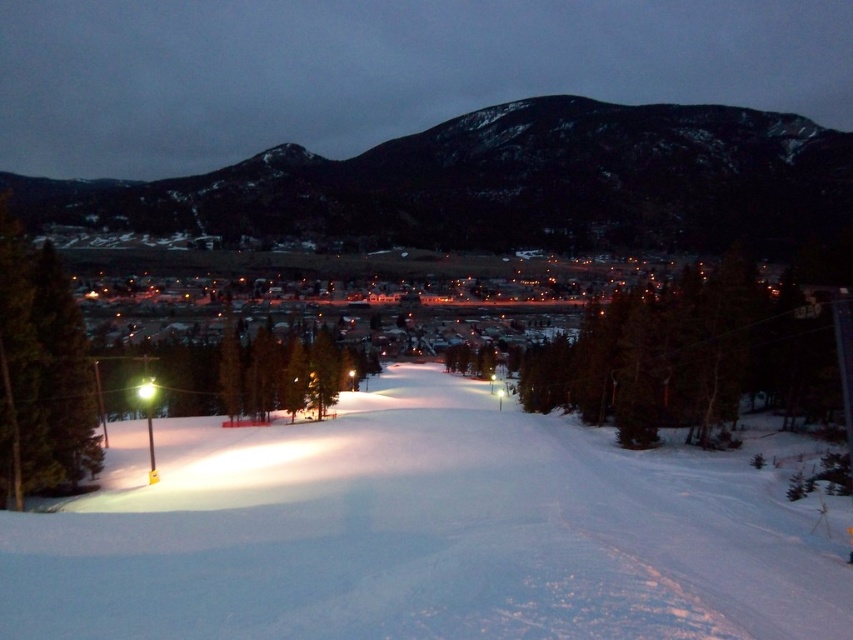
You are a skier standing at the base of the slope and want to reach the top of the white snow ski slope at center. If you can ski at a speed of 5 meters per second, how long will it take you to reach the top?

The distance between you and the white snow ski slope at center is 16.70 meters. At a speed of 5 meters per second, it will take you 16.70 divided by 5 equals 3.34 seconds to reach the top.

You are a skier planning to descend from the dark gray rocky hill at upper center to the white snow ski slope at center. Based on the scene description, which direction should you head to reach the slope?

The white snow ski slope at center is located below the dark gray rocky hill at upper center, so you should head downward towards the white snow ski slope at center to reach the slope.